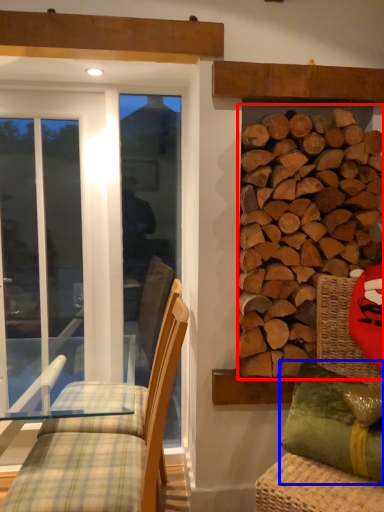
Question: Which object is further to the camera taking this photo, hardwood (highlighted by a red box) or pillow (highlighted by a blue box)?

Choices:
 (A) hardwood
 (B) pillow

Answer: (A)